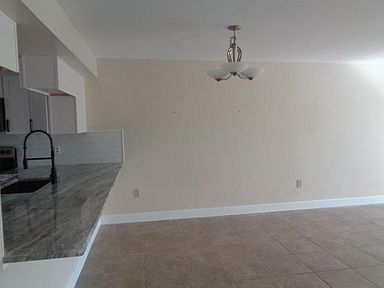
What are the coordinates of `light in corner` in the screenshot? It's located at (360, 62).